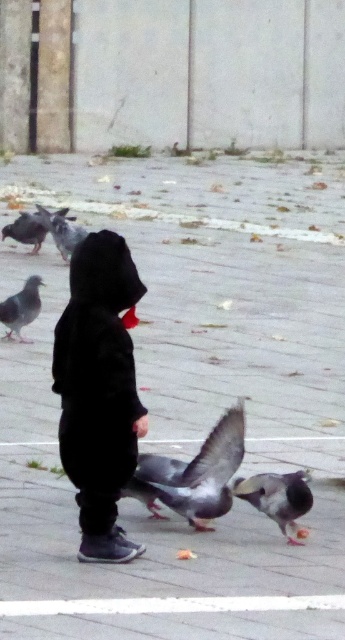
Who is positioned more to the left, gray matte pigeon at left or gray matte pigeon at upper left?

Positioned to the left is gray matte pigeon at left.

Does gray matte pigeon at left appear on the left side of gray matte pigeon at upper left?

Correct, you'll find gray matte pigeon at left to the left of gray matte pigeon at upper left.

Is point (30, 296) closer to viewer compared to point (64, 224)?

That is True.

The height and width of the screenshot is (640, 345). I want to click on gray matte pigeon at left, so click(22, 307).

Where is `black matte hoodie at center`? The image size is (345, 640). black matte hoodie at center is located at coordinates (99, 392).

Is black matte hoodie at center bigger than gray matte pigeon at upper left?

Yes.

Does point (116, 532) come closer to viewer compared to point (55, 225)?

Yes, point (116, 532) is in front of point (55, 225).

Locate an element on the screen. This screenshot has height=640, width=345. black matte hoodie at center is located at coordinates point(99,392).

Does gray matte pigeon at center have a greater height compared to gray matte pigeon at lower center?

Yes, gray matte pigeon at center is taller than gray matte pigeon at lower center.

The width and height of the screenshot is (345, 640). In order to click on gray matte pigeon at center in this screenshot , I will do `click(198, 472)`.